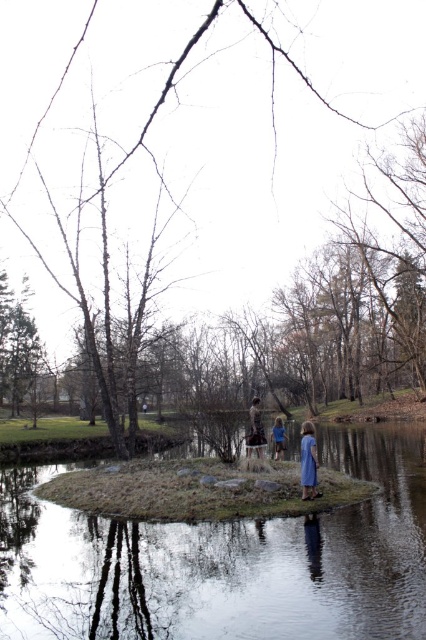
Is dark brown leather jacket at center bigger than blue fabric dress at center?

Yes.

Between dark brown leather jacket at center and blue fabric dress at center, which one appears on the left side from the viewer's perspective?

dark brown leather jacket at center is more to the left.

Between point (258, 406) and point (284, 451), which one is positioned in front?

Point (258, 406) is in front.

At what (x,y) coordinates should I click in order to perform the action: click on dark brown leather jacket at center. Please return your answer as a coordinate pair (x, y). Looking at the image, I should click on (255, 428).

Between blue cotton dress at center and blue fabric dress at center, which one has less height?

blue fabric dress at center is shorter.

What do you see at coordinates (308, 461) in the screenshot? I see `blue cotton dress at center` at bounding box center [308, 461].

What are the coordinates of `blue cotton dress at center` in the screenshot? It's located at (308, 461).

How far apart are brown bark tree at center and dark brown leather jacket at center?

The distance of brown bark tree at center from dark brown leather jacket at center is 27.01 meters.

Which is behind, point (348, 77) or point (253, 442)?

The point (348, 77) is more distant.

You are a GUI agent. You are given a task and a screenshot of the screen. Output one action in this format:
    pyautogui.click(x=<x>, y=<y>)
    Task: Click on the brown bark tree at center
    Image resolution: width=426 pixels, height=640 pixels.
    Given the screenshot: What is the action you would take?
    pyautogui.click(x=247, y=164)